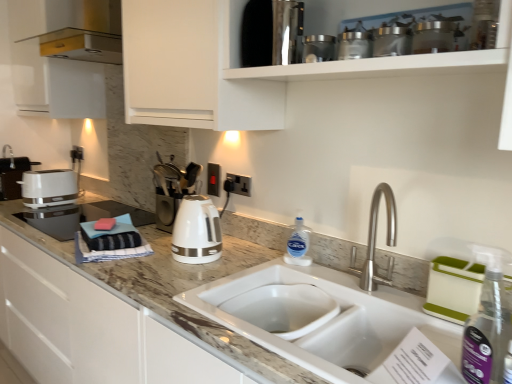
Locate an element on the screen. free location to the right of white glossy electric kettle at center is located at coordinates (247, 263).